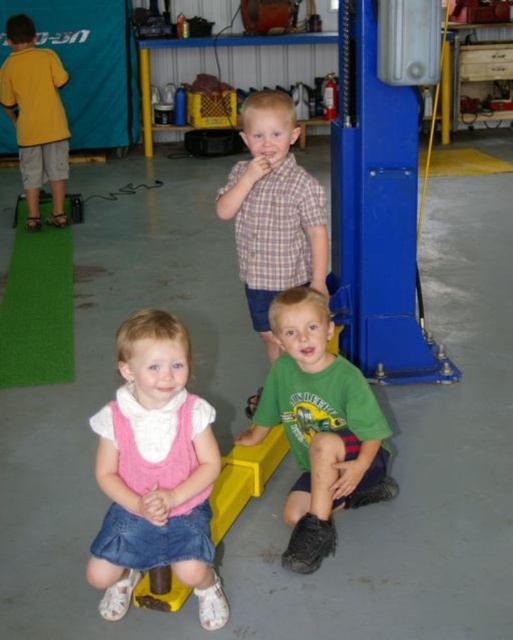
You are a photographer setting up a shoot in this garage. You want to ensure that both the green matte shirt at lower center and the plaid shirt at center are visible in the frame. Based on their positions, which shirt should you focus on first to capture both in the shot?

The green matte shirt at lower center is below the plaid shirt at center, so focusing on the plaid shirt at center first will ensure both shirts are visible in the frame.

Consider the image. You are a photographer setting up a photo shoot in the garage. You want to ensure that the green matte shirt at lower center and the plaid shirt at center are both visible in the frame. Based on their positions, which shirt should you focus on to ensure both are in focus?

The green matte shirt at lower center is in front of the plaid shirt at center, so focusing on the green matte shirt at lower center will ensure both are in focus since it is closer to the camera.